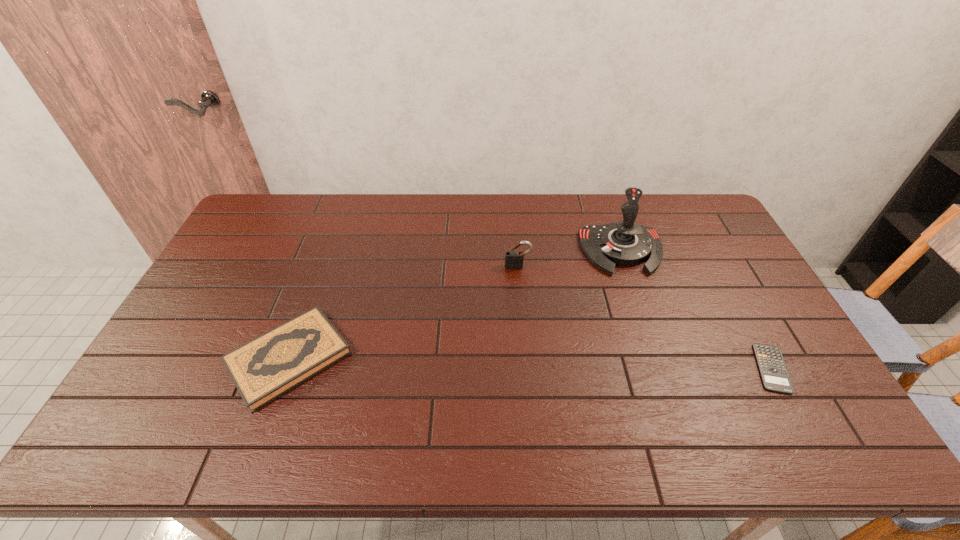
You are a GUI agent. You are given a task and a screenshot of the screen. Output one action in this format:
    pyautogui.click(x=<x>, y=<y>)
    Task: Click on the joystick
    
    Given the screenshot: What is the action you would take?
    pyautogui.click(x=625, y=243)

The height and width of the screenshot is (540, 960). In order to click on the tallest object in this screenshot , I will do `click(625, 243)`.

Find the location of a particular element. the third object from right to left is located at coordinates (513, 259).

Locate an element on the screen. This screenshot has width=960, height=540. the third shortest object is located at coordinates (513, 259).

You are a GUI agent. You are given a task and a screenshot of the screen. Output one action in this format:
    pyautogui.click(x=<x>, y=<y>)
    Task: Click on the leftmost object
    
    Given the screenshot: What is the action you would take?
    pyautogui.click(x=263, y=369)

Find the location of `the third tallest object`. the third tallest object is located at coordinates (263, 369).

I want to click on the rightmost object, so click(774, 374).

Where is `calculator`? The image size is (960, 540). calculator is located at coordinates (774, 374).

Locate an element on the screen. This screenshot has width=960, height=540. vacant area situated on the handle side of the third object from left to right is located at coordinates (654, 346).

Identify the location of free space located with the keyhole on the front of the second tallest object. The image size is (960, 540). (527, 369).